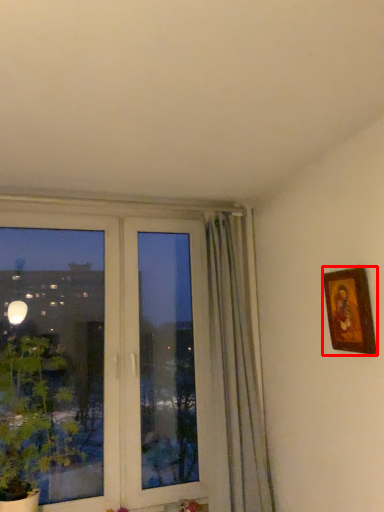
Question: Considering the relative positions of picture frame (annotated by the red box) and plant in the image provided, where is picture frame (annotated by the red box) located with respect to the staircase?

Choices:
 (A) left
 (B) right

Answer: (B)